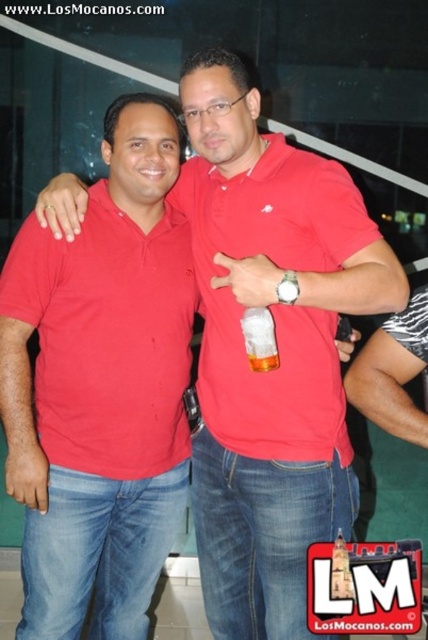
Does matte red polo shirt at left appear on the left side of translucent plastic cup at center?

Indeed, matte red polo shirt at left is positioned on the left side of translucent plastic cup at center.

Does matte red polo shirt at left have a greater height compared to translucent plastic cup at center?

Correct, matte red polo shirt at left is much taller as translucent plastic cup at center.

Does point (44, 384) lie in front of point (261, 337)?

No, it is not.

Find the location of `matte red polo shirt at left`. matte red polo shirt at left is located at coordinates (107, 337).

In the scene shown: Between matte red polo shirt at left and matte red polo shirt at center, which one has less height?

matte red polo shirt at left is shorter.

Is point (145, 244) less distant than point (285, 193)?

That is False.

Between point (44, 416) and point (311, 365), which one is positioned in front?

Positioned in front is point (311, 365).

At what (x,y) coordinates should I click in order to perform the action: click on matte red polo shirt at left. Please return your answer as a coordinate pair (x, y). Looking at the image, I should click on (107, 337).

Can you confirm if matte red polo shirt at center is wider than translucent plastic cup at center?

Correct, the width of matte red polo shirt at center exceeds that of translucent plastic cup at center.

Who is higher up, matte red polo shirt at center or translucent plastic cup at center?

Positioned higher is matte red polo shirt at center.

What do you see at coordinates (275, 304) in the screenshot? I see `matte red polo shirt at center` at bounding box center [275, 304].

At what (x,y) coordinates should I click in order to perform the action: click on matte red polo shirt at center. Please return your answer as a coordinate pair (x, y). The image size is (428, 640). Looking at the image, I should click on (275, 304).